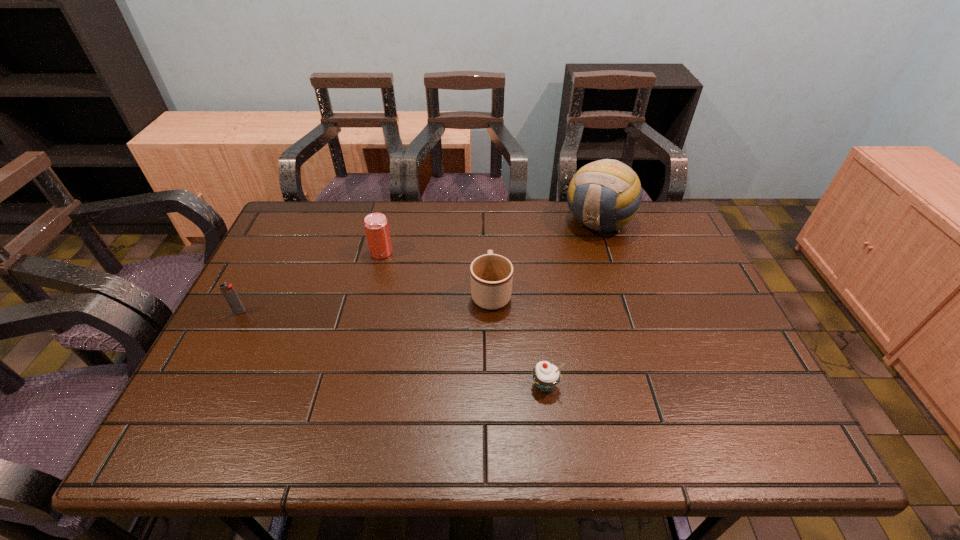
At what (x,y) coordinates should I click in order to perform the action: click on vacant space at the far edge of the desktop. Please return your answer as a coordinate pair (x, y). This screenshot has height=540, width=960. Looking at the image, I should click on (482, 219).

I want to click on vacant point at the near edge, so click(x=439, y=430).

In the image, there is a desktop. At what (x,y) coordinates should I click in order to perform the action: click on blank space at the left edge. Please return your answer as a coordinate pair (x, y). Looking at the image, I should click on (290, 327).

I want to click on vacant space at the right edge of the desktop, so click(703, 326).

Locate an element on the screen. The image size is (960, 540). blank space at the far left corner of the desktop is located at coordinates (278, 241).

Find the location of a particular element. The image size is (960, 540). vacant space at the far right corner of the desktop is located at coordinates (634, 236).

Image resolution: width=960 pixels, height=540 pixels. In the image, there is a desktop. What are the coordinates of `vacant region at the near right corner` in the screenshot? It's located at (782, 452).

At what (x,y) coordinates should I click in order to perform the action: click on vacant area between the second object from right to left and the second object from left to right. Please return your answer as a coordinate pair (x, y). The image size is (960, 540). Looking at the image, I should click on (464, 319).

At what (x,y) coordinates should I click in order to perform the action: click on free space between the beer can and the nearest object. Please return your answer as a coordinate pair (x, y). This screenshot has width=960, height=540. Looking at the image, I should click on (464, 319).

Find the location of a particular element. The height and width of the screenshot is (540, 960). vacant point located between the mug and the igniter is located at coordinates (366, 302).